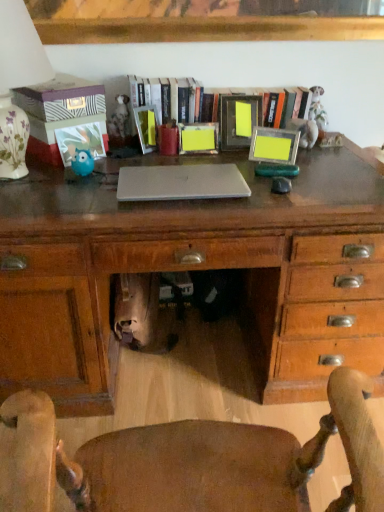
Question: Is matte wooden desk at center not inside satin silver laptop at center?

Choices:
 (A) no
 (B) yes

Answer: (B)

Question: Is matte wooden desk at center further to camera compared to satin silver laptop at center?

Choices:
 (A) yes
 (B) no

Answer: (B)

Question: Considering the relative sizes of matte wooden desk at center and satin silver laptop at center in the image provided, is matte wooden desk at center shorter than satin silver laptop at center?

Choices:
 (A) yes
 (B) no

Answer: (B)

Question: Considering the relative positions of matte wooden desk at center and satin silver laptop at center in the image provided, is matte wooden desk at center to the left of satin silver laptop at center from the viewer's perspective?

Choices:
 (A) no
 (B) yes

Answer: (B)

Question: Does matte wooden desk at center have a greater width compared to satin silver laptop at center?

Choices:
 (A) no
 (B) yes

Answer: (B)

Question: Could you tell me if matte wooden desk at center is turned towards satin silver laptop at center?

Choices:
 (A) no
 (B) yes

Answer: (A)

Question: Could you tell me if matte wooden desk at center is turned towards wooden frame at center?

Choices:
 (A) yes
 (B) no

Answer: (B)

Question: Considering the relative sizes of matte wooden desk at center and wooden frame at center in the image provided, is matte wooden desk at center shorter than wooden frame at center?

Choices:
 (A) no
 (B) yes

Answer: (A)

Question: From a real-world perspective, does matte wooden desk at center stand above wooden frame at center?

Choices:
 (A) no
 (B) yes

Answer: (A)

Question: From the image's perspective, is matte wooden desk at center on wooden frame at center?

Choices:
 (A) yes
 (B) no

Answer: (B)

Question: Is the depth of matte wooden desk at center greater than that of wooden frame at center?

Choices:
 (A) no
 (B) yes

Answer: (A)

Question: Is wooden frame at center at the back of matte wooden desk at center?

Choices:
 (A) no
 (B) yes

Answer: (A)

Question: Is wooden frame at center located within wooden chair at center?

Choices:
 (A) yes
 (B) no

Answer: (B)